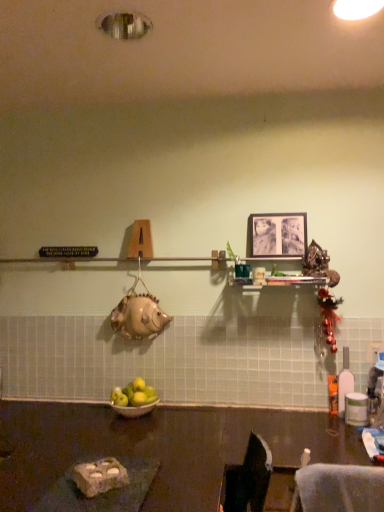
Find the location of a particular element. The height and width of the screenshot is (512, 384). empty space that is ontop of dark brown polished table at lower center (from a real-world perspective) is located at coordinates (95, 426).